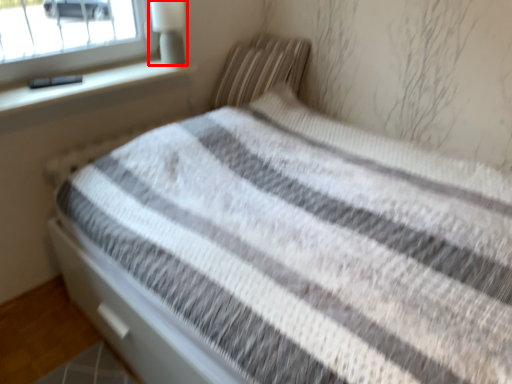
Question: From the image's perspective, what is the correct spatial positioning of lamp (annotated by the red box) in reference to pillow?

Choices:
 (A) above
 (B) below

Answer: (A)